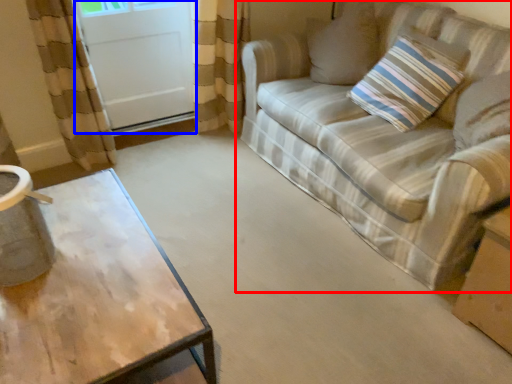
Question: Among these objects, which one is nearest to the camera, studio couch (highlighted by a red box) or screen door (highlighted by a blue box)?

Choices:
 (A) studio couch
 (B) screen door

Answer: (A)